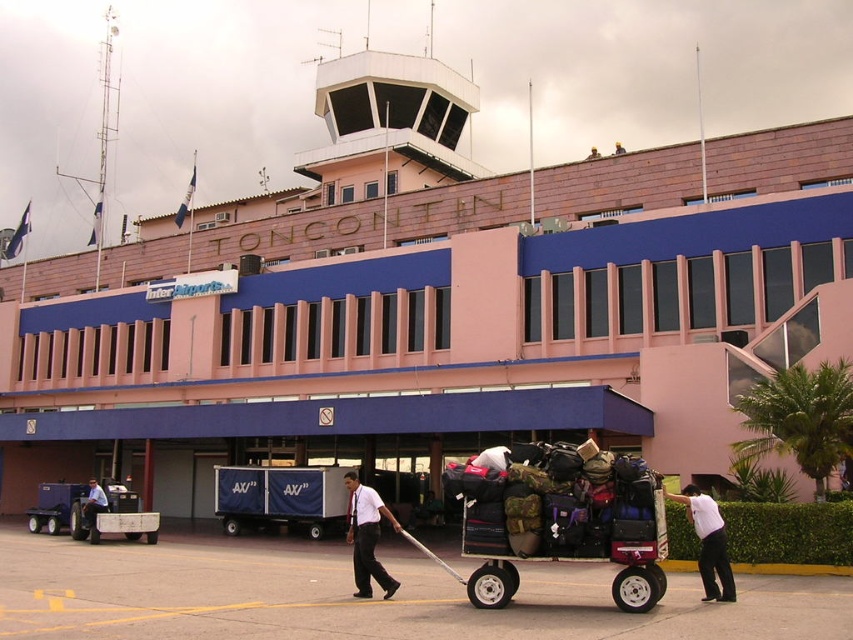
You are a maintenance worker at Toncontin International Airport. You need to move equipment from your current position to the control tower. The control tower is 50 meters away from your current position. Is the metallic blue cart at left within the distance you can reach before reaching the control tower?

The metallic blue cart at left is 44.23 meters from camera, which is within the 50 meters distance to the control tower. Therefore, you can reach the metallic blue cart at left before arriving at the control tower.

You are standing at the entrance of Toncontin International Airport and want to locate two specific points marked in the image. Which of the two points, point 1 at coordinates point (79, 490) or point 2 at coordinates point (91, 538), is closer to you?

Point 1 at coordinates point (79, 490) is closer to you because it is further to the viewer than point 2 at coordinates point (91, 538).